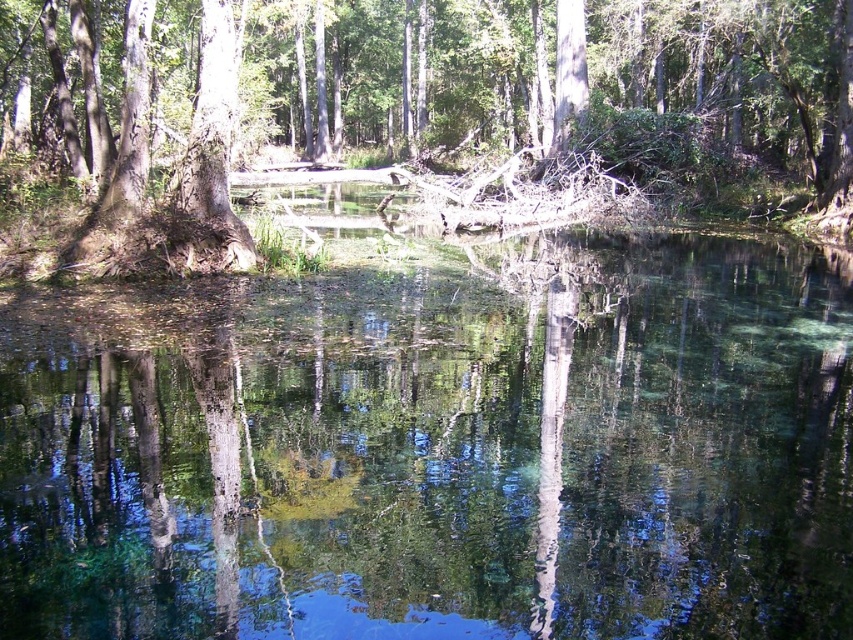
Is point (96, 432) closer to viewer compared to point (260, 36)?

Yes, point (96, 432) is closer to viewer.

Does point (485, 348) come in front of point (148, 44)?

Yes, it is in front of point (148, 44).

Find the location of a particular element. The height and width of the screenshot is (640, 853). clear water at center is located at coordinates (440, 451).